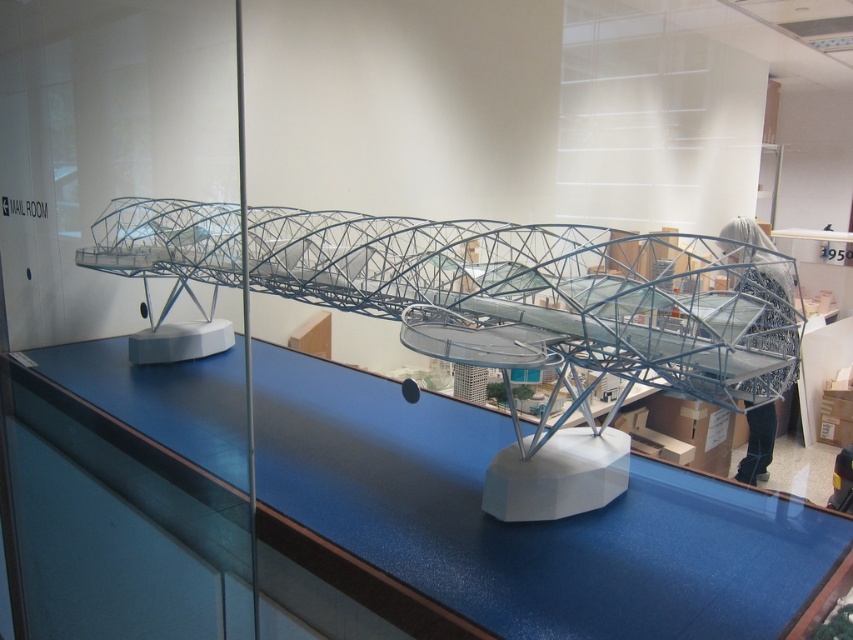
Who is shorter, transparent glass table at center or metallic wireframe bridge at center?

With less height is transparent glass table at center.

Can you confirm if transparent glass table at center is thinner than metallic wireframe bridge at center?

Incorrect, transparent glass table at center's width is not less than metallic wireframe bridge at center's.

Is point (318, 472) less distant than point (755, 262)?

No, it is behind (755, 262).

This screenshot has height=640, width=853. Identify the location of transparent glass table at center. (526, 524).

Can you confirm if metallic wireframe bridge at center is positioned to the left of metallic wireframe bridge at right?

Indeed, metallic wireframe bridge at center is positioned on the left side of metallic wireframe bridge at right.

Does metallic wireframe bridge at center have a lesser height compared to metallic wireframe bridge at right?

Indeed, metallic wireframe bridge at center has a lesser height compared to metallic wireframe bridge at right.

This screenshot has height=640, width=853. What are the coordinates of `metallic wireframe bridge at center` in the screenshot? It's located at (538, 422).

Describe the element at coordinates (526, 524) in the screenshot. I see `transparent glass table at center` at that location.

Which is below, transparent glass table at center or metallic wireframe bridge at right?

transparent glass table at center

Who is more forward, (496, 433) or (785, 296)?

Point (496, 433) is more forward.

Image resolution: width=853 pixels, height=640 pixels. What are the coordinates of `transparent glass table at center` in the screenshot? It's located at (526, 524).